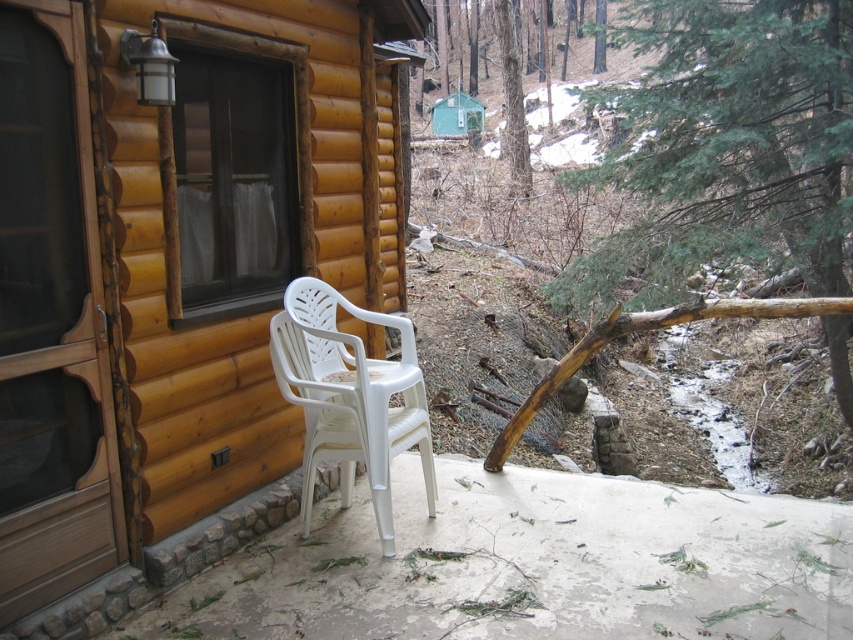
You are a guest at the cabin and want to sit on the higher chair to enjoy the view. Which chair should you choose between the matte plastic chair at lower right and the white plastic chair at lower center?

The matte plastic chair at lower right has a greater height compared to the white plastic chair at lower center, so you should choose the matte plastic chair at lower right to enjoy the view.

You are standing at the entrance of the rustic wooden cabin and want to sit down on the matte plastic chair at lower right. Which direction should you walk to reach it?

You should walk towards the lower right direction to reach the matte plastic chair at lower right, as it is located at point (171, 269).